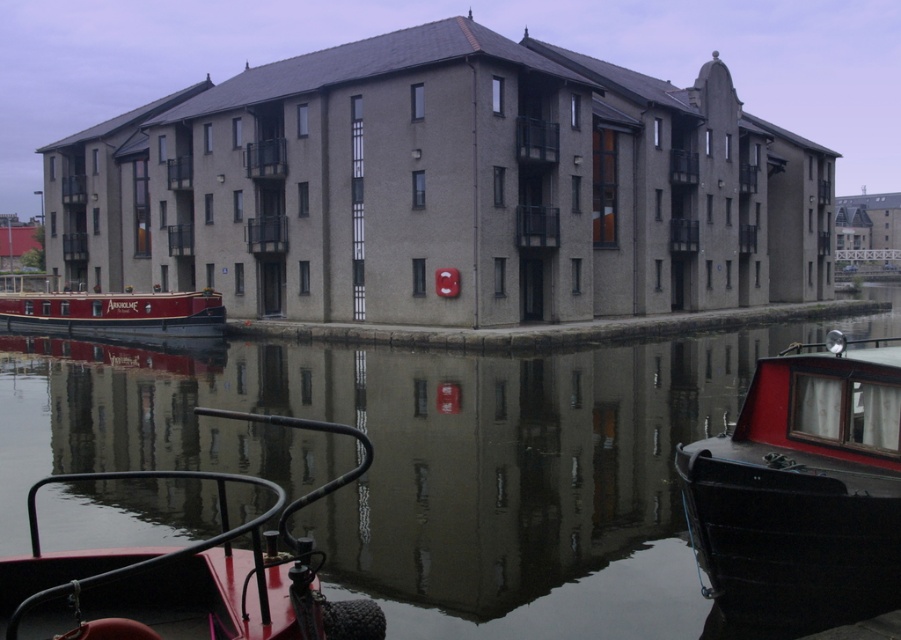
Can you confirm if red polished wood boat at right is positioned to the right of matte red boat at left?

Correct, you'll find red polished wood boat at right to the right of matte red boat at left.

Is red polished wood boat at right smaller than matte red boat at left?

Correct, red polished wood boat at right occupies less space than matte red boat at left.

Does point (703, 456) lie behind point (169, 317)?

No, it is not.

Locate an element on the screen. red polished wood boat at right is located at coordinates (803, 490).

Who is positioned more to the right, red polished wood boat at right or metallic red boat at lower left?

Positioned to the right is red polished wood boat at right.

Locate an element on the screen. red polished wood boat at right is located at coordinates (803, 490).

Is smooth concrete canal at center bigger than matte red boat at left?

Incorrect, smooth concrete canal at center is not larger than matte red boat at left.

Is smooth concrete canal at center below matte red boat at left?

Yes, smooth concrete canal at center is below matte red boat at left.

Which is behind, point (160, 412) or point (70, 333)?

The point (70, 333) is behind.

Where is `smooth concrete canal at center`? smooth concrete canal at center is located at coordinates [426, 461].